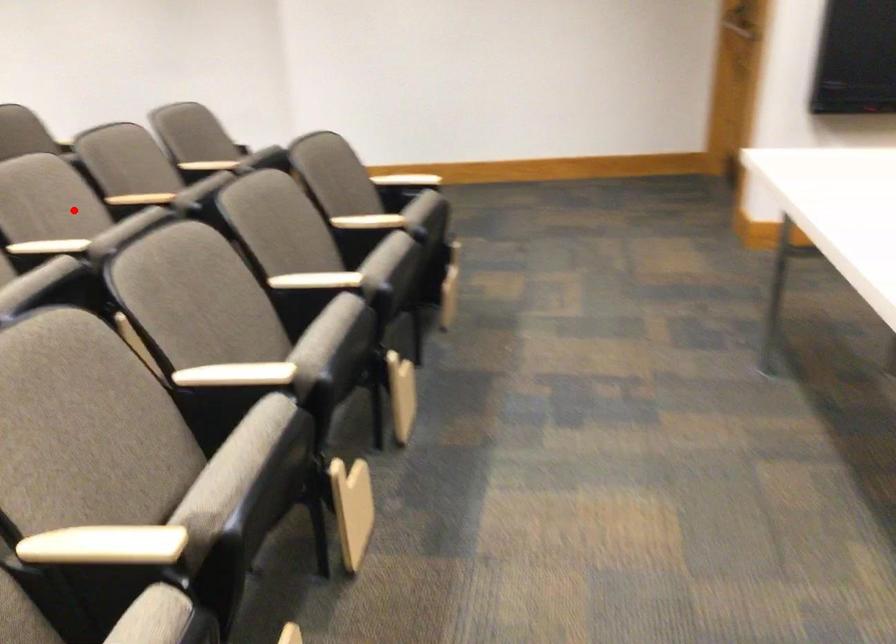
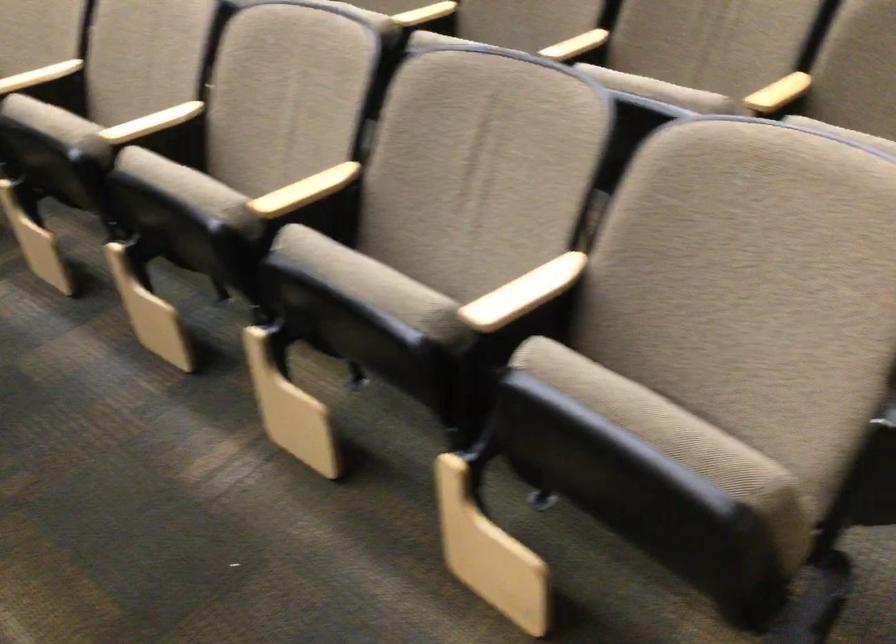
Question: I am providing you with two images of the same scene from different viewpoints. In image1, a red point is highlighted. Considering the same 3D point in image2, which of the following is correct?

Choices:
 (A) It is closer
 (B) It is farther

Answer: (A)